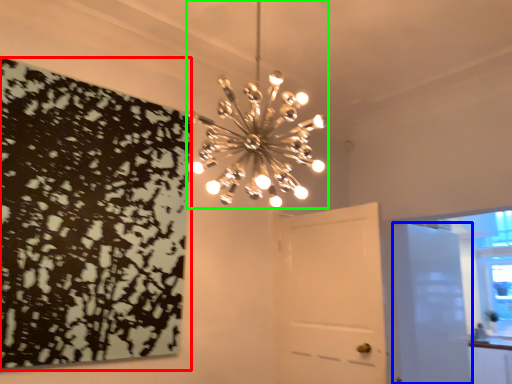
Question: Which object is the farthest from print (highlighted by a red box)? Choose among these: door (highlighted by a blue box) or lamp (highlighted by a green box).

Choices:
 (A) door
 (B) lamp

Answer: (A)